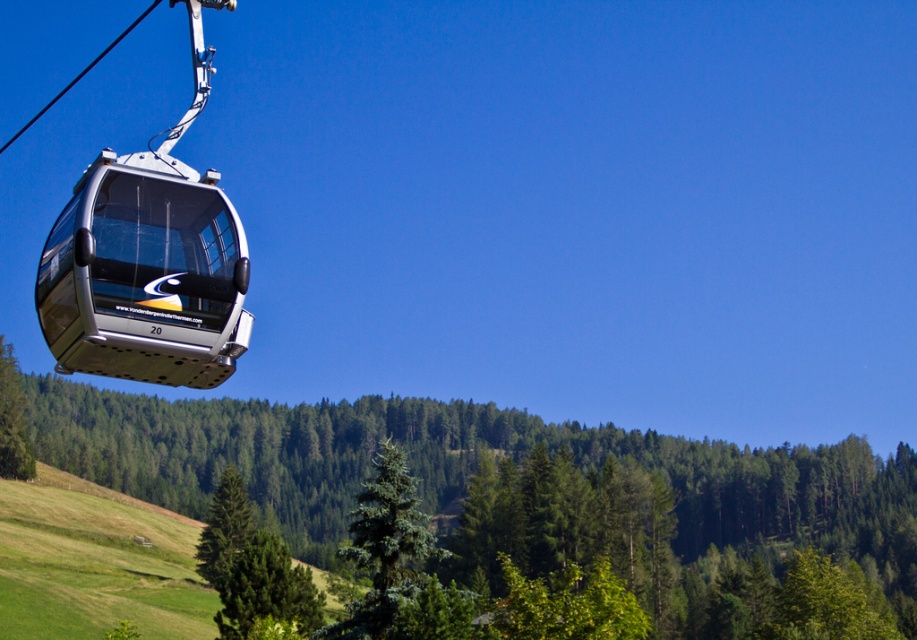
Can you confirm if green matte tree at center is positioned to the left of metallic cable car at left?

In fact, green matte tree at center is to the right of metallic cable car at left.

The width and height of the screenshot is (917, 640). I want to click on green matte tree at center, so point(506,490).

Does point (217, 253) come farther from viewer compared to point (396, 484)?

No.

Who is lower down, metallic cable car at left or green fir tree at center?

Positioned lower is green fir tree at center.

Between point (181, 364) and point (380, 456), which one is positioned in front?

Point (181, 364) is more forward.

Locate an element on the screen. This screenshot has height=640, width=917. metallic cable car at left is located at coordinates (148, 260).

Is point (324, 534) in front of point (365, 534)?

No.

Measure the distance between point (203, 468) and camera.

222.11 meters

I want to click on green matte tree at center, so click(x=506, y=490).